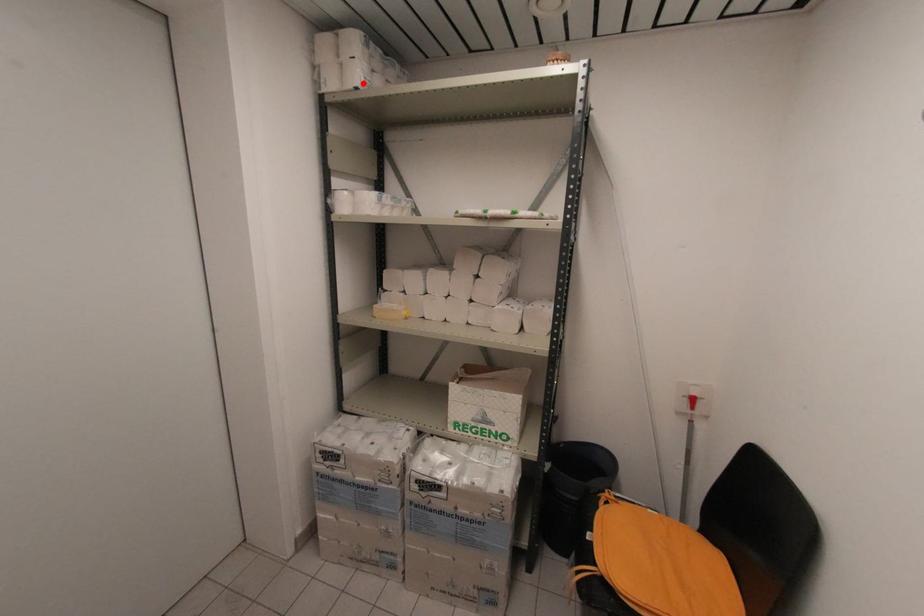
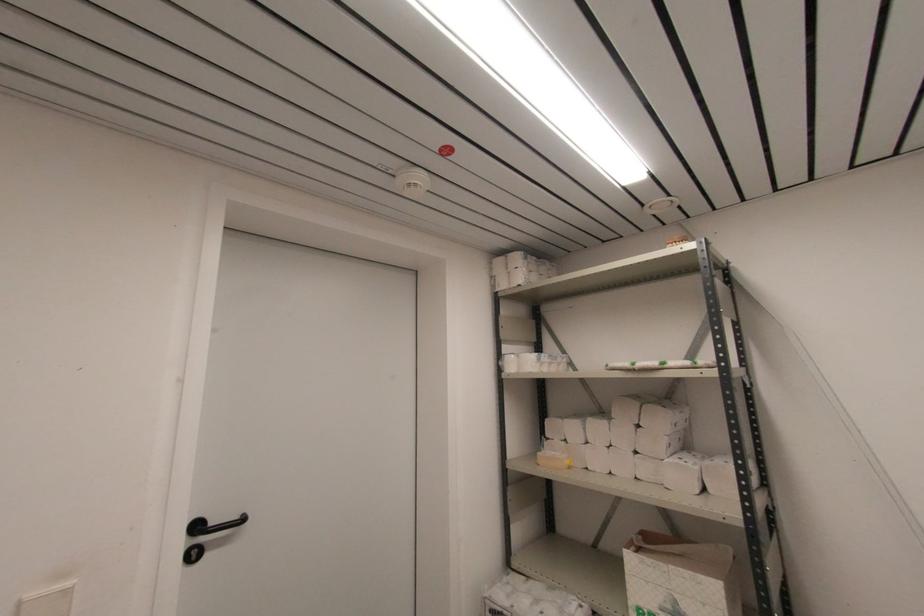
Locate, in the second image, the point that corresponds to the highlighted location in the first image.

(524, 282)